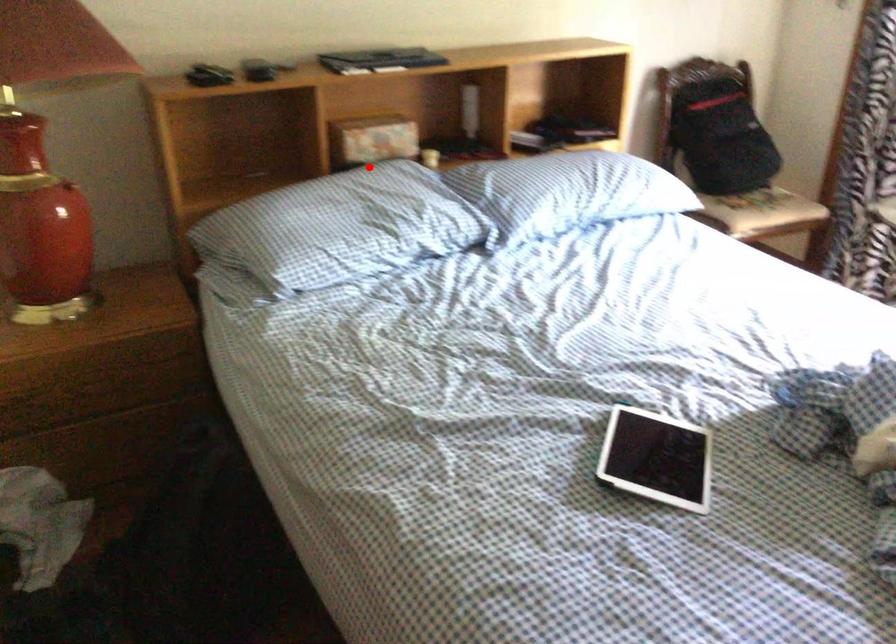
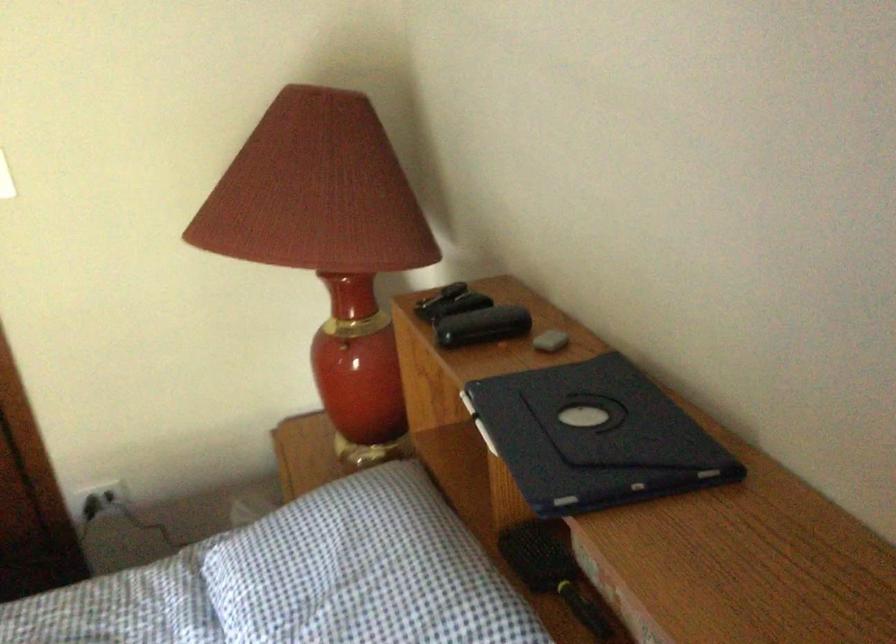
In the second image, find the point that corresponds to the highlighted location in the first image.

(552, 571)